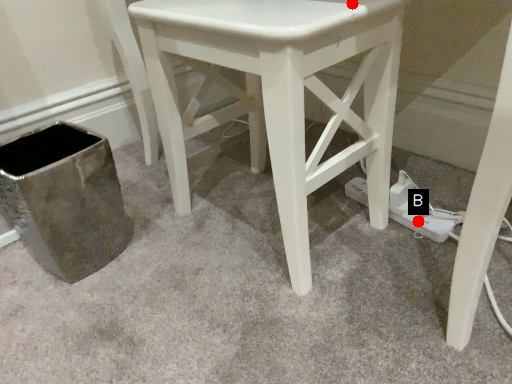
Question: Two points are circled on the image, labeled by A and B beside each circle. Among these points, which one is nearest to the camera?

Choices:
 (A) A is closer
 (B) B is closer

Answer: (A)